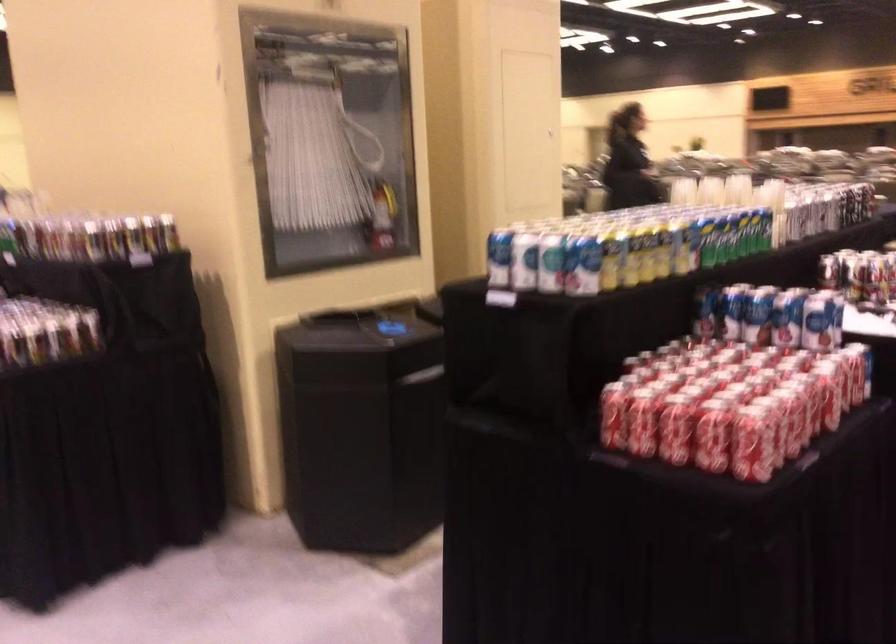
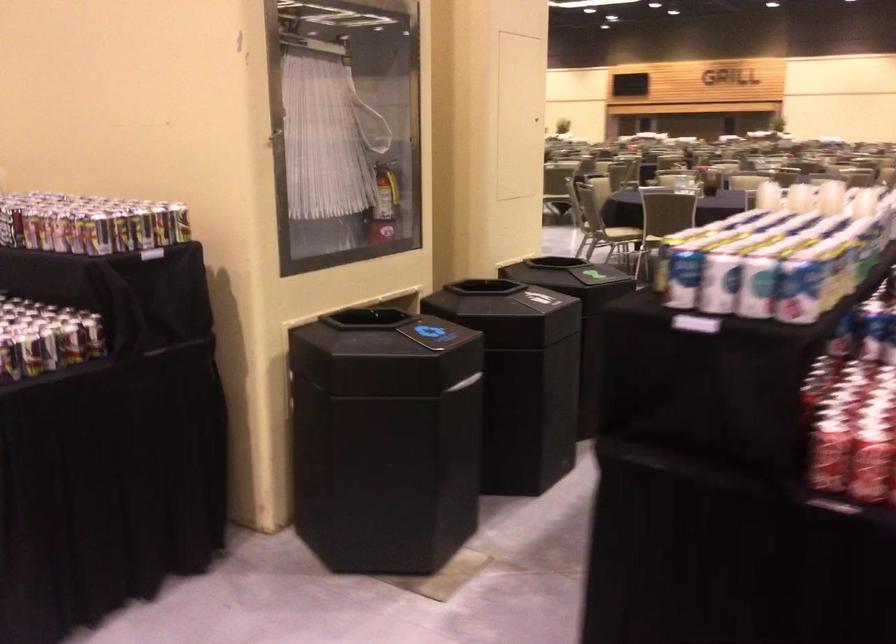
Question: The images are taken continuously from a first-person perspective. In which direction is your viewpoint rotating?

Choices:
 (A) Left
 (B) Right
 (C) Up
 (D) Down

Answer: (B)